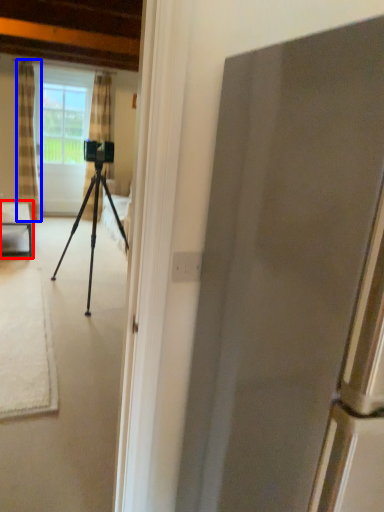
Question: Among these objects, which one is nearest to the camera, table (highlighted by a red box) or curtain (highlighted by a blue box)?

Choices:
 (A) table
 (B) curtain

Answer: (A)